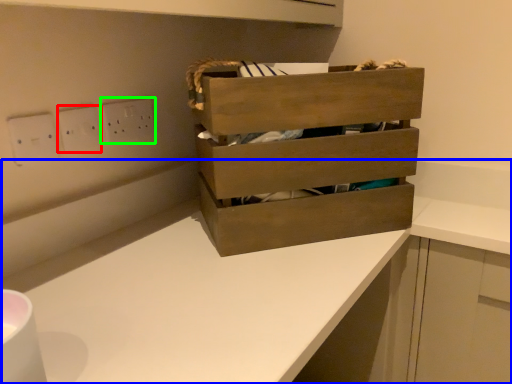
Question: Which is farther away from electric outlet (highlighted by a red box)? counter (highlighted by a blue box) or electric outlet (highlighted by a green box)?

Choices:
 (A) counter
 (B) electric outlet

Answer: (A)